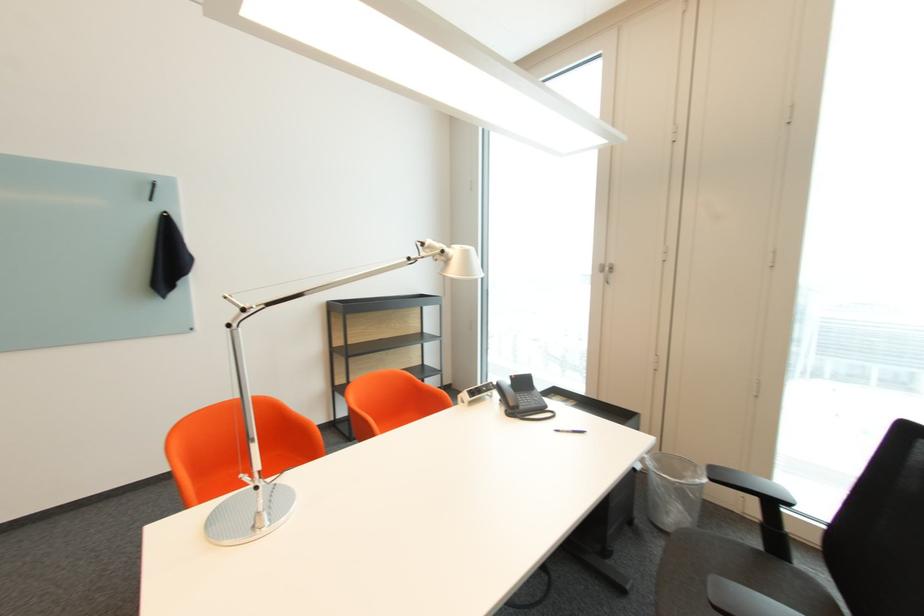
What do you see at coordinates (456, 260) in the screenshot? The image size is (924, 616). I see `a white lamp head` at bounding box center [456, 260].